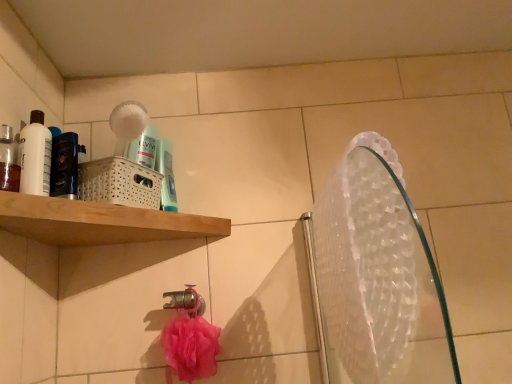
The width and height of the screenshot is (512, 384). What do you see at coordinates (378, 276) in the screenshot? I see `transparent plastic mirror at upper right` at bounding box center [378, 276].

Where is `metallic chrome tap at lower center`? metallic chrome tap at lower center is located at coordinates (186, 301).

I want to click on translucent plastic mouthwash at left, acting as the third mouthwash starting from the right, so tap(9, 160).

This screenshot has width=512, height=384. I want to click on blue glossy mouthwash at upper center, the first mouthwash positioned from the right, so click(166, 176).

You are a GUI agent. You are given a task and a screenshot of the screen. Output one action in this format:
    pyautogui.click(x=<x>, y=<y>)
    Task: Click on the transparent plastic mirror at upper right
    
    Given the screenshot: What is the action you would take?
    pyautogui.click(x=378, y=276)

Can translucent plastic mouthwash at left, which is counted as the 1th mouthwash, starting from the front, be found inside white glossy bottle at left, the second mouthwash positioned from the back?

Actually, translucent plastic mouthwash at left, which is counted as the 1th mouthwash, starting from the front, is outside white glossy bottle at left, the second mouthwash positioned from the back.

Does white glossy bottle at left, the second mouthwash positioned from the back, appear on the left side of translucent plastic mouthwash at left, which appears as the first mouthwash when viewed from the left?

No.

Which point is more distant from viewer, [32,118] or [17,167]?

The point [32,118] is more distant.

Looking at this image, between white glossy bottle at left, the second mouthwash when ordered from front to back, and translucent plastic mouthwash at left, which is counted as the 1th mouthwash, starting from the front, which one has smaller width?

Thinner between the two is white glossy bottle at left, the second mouthwash when ordered from front to back.

In terms of width, does translucent plastic mouthwash at left, acting as the third mouthwash starting from the right, look wider or thinner when compared to metallic chrome tap at lower center?

In the image, translucent plastic mouthwash at left, acting as the third mouthwash starting from the right, appears to be more narrow than metallic chrome tap at lower center.

Is translucent plastic mouthwash at left, which is counted as the 1th mouthwash, starting from the front, facing towards metallic chrome tap at lower center?

No, translucent plastic mouthwash at left, which is counted as the 1th mouthwash, starting from the front, is not oriented towards metallic chrome tap at lower center.

Which is farther from the camera, (18, 178) or (191, 299)?

Positioned behind is point (191, 299).

Is metallic chrome tap at lower center not close to transparent plastic mirror at upper right?

That's not correct — metallic chrome tap at lower center is a little close to transparent plastic mirror at upper right.

In the scene shown: Is the position of metallic chrome tap at lower center less distant than that of transparent plastic mirror at upper right?

No, metallic chrome tap at lower center is further to the viewer.

Can you confirm if metallic chrome tap at lower center is smaller than transparent plastic mirror at upper right?

Yes.

Measure the distance from blue glossy mouthwash at upper center, which is the first mouthwash in back-to-front order, to white glossy bottle at left, the second mouthwash positioned from the back.

A distance of 11.31 inches exists between blue glossy mouthwash at upper center, which is the first mouthwash in back-to-front order, and white glossy bottle at left, the second mouthwash positioned from the back.

Does blue glossy mouthwash at upper center, which is the first mouthwash in back-to-front order, lie in front of white glossy bottle at left, the second mouthwash positioned from the left?

No.

Can you confirm if blue glossy mouthwash at upper center, which is the 3th mouthwash in front-to-back order, is shorter than white glossy bottle at left, the second mouthwash when ordered from front to back?

Yes, blue glossy mouthwash at upper center, which is the 3th mouthwash in front-to-back order, is shorter than white glossy bottle at left, the second mouthwash when ordered from front to back.

Considering the positions of objects blue glossy mouthwash at upper center, which is counted as the third mouthwash, starting from the left, and white glossy bottle at left, the second mouthwash from the right, in the image provided, who is more to the right, blue glossy mouthwash at upper center, which is counted as the third mouthwash, starting from the left, or white glossy bottle at left, the second mouthwash from the right,?

From the viewer's perspective, blue glossy mouthwash at upper center, which is counted as the third mouthwash, starting from the left, appears more on the right side.

Does translucent plastic mouthwash at left, which is counted as the 1th mouthwash, starting from the front, lie in front of white glossy bottle at left, the second mouthwash positioned from the back?

Yes, it is.

How different are the orientations of translucent plastic mouthwash at left, which is counted as the 1th mouthwash, starting from the front, and white glossy bottle at left, the second mouthwash from the right, in degrees?

The angle between the facing direction of translucent plastic mouthwash at left, which is counted as the 1th mouthwash, starting from the front, and the facing direction of white glossy bottle at left, the second mouthwash from the right, is 16.1 degrees.

From a real-world perspective, between translucent plastic mouthwash at left, which is counted as the 1th mouthwash, starting from the front, and white glossy bottle at left, the second mouthwash from the right, who is vertically lower?

translucent plastic mouthwash at left, which is counted as the 1th mouthwash, starting from the front, is physically lower.

Is white glossy bottle at left, the second mouthwash positioned from the left, located within translucent plastic mouthwash at left, the third mouthwash from the back?

No, white glossy bottle at left, the second mouthwash positioned from the left, is not surrounded by translucent plastic mouthwash at left, the third mouthwash from the back.

Is transparent plastic mirror at upper right not inside blue glossy mouthwash at upper center, which is the first mouthwash in back-to-front order?

transparent plastic mirror at upper right lies outside blue glossy mouthwash at upper center, which is the first mouthwash in back-to-front order,'s area.

Considering the positions of point (339, 225) and point (174, 197), is point (339, 225) closer or farther from the camera than point (174, 197)?

Clearly, point (339, 225) is closer to the camera than point (174, 197).

Does transparent plastic mirror at upper right have a lesser width compared to blue glossy mouthwash at upper center, which is the 3th mouthwash in front-to-back order?

No.

Would you say transparent plastic mirror at upper right is outside white glossy bottle at left, the second mouthwash when ordered from front to back?

Yes, transparent plastic mirror at upper right is located beyond the bounds of white glossy bottle at left, the second mouthwash when ordered from front to back.

Which is more to the right, transparent plastic mirror at upper right or white glossy bottle at left, the second mouthwash positioned from the left?

From the viewer's perspective, transparent plastic mirror at upper right appears more on the right side.

Which mouthwash is the 2nd one when counting from the back of the transparent plastic mirror at upper right? Please provide its 2D coordinates.

[(35, 156)]

Is the position of transparent plastic mirror at upper right less distant than that of white glossy bottle at left, the second mouthwash when ordered from front to back?

Yes.

Image resolution: width=512 pixels, height=384 pixels. What are the coordinates of `mouthwash that is on the left side of white glossy bottle at left, the second mouthwash positioned from the back` in the screenshot? It's located at (9, 160).

Where is `the 3rd mouthwash in front of the metallic chrome tap at lower center`? Image resolution: width=512 pixels, height=384 pixels. the 3rd mouthwash in front of the metallic chrome tap at lower center is located at coordinates (9, 160).

Based on their spatial positions, is transparent plastic mirror at upper right or metallic chrome tap at lower center closer to translucent plastic mouthwash at left, which appears as the first mouthwash when viewed from the left?

metallic chrome tap at lower center lies closer to translucent plastic mouthwash at left, which appears as the first mouthwash when viewed from the left, than the other object.

Which object lies further to the anchor point blue glossy mouthwash at upper center, which is the first mouthwash in back-to-front order, translucent plastic mouthwash at left, which appears as the first mouthwash when viewed from the left, or transparent plastic mirror at upper right?

transparent plastic mirror at upper right.

When comparing their distances from metallic chrome tap at lower center, does transparent plastic mirror at upper right or white glossy bottle at left, the second mouthwash from the right, seem closer?

Based on the image, white glossy bottle at left, the second mouthwash from the right, appears to be nearer to metallic chrome tap at lower center.

Looking at the image, which one is located closer to translucent plastic mouthwash at left, which is counted as the 1th mouthwash, starting from the front, transparent plastic mirror at upper right or white glossy bottle at left, the second mouthwash when ordered from front to back?

white glossy bottle at left, the second mouthwash when ordered from front to back, is closer to translucent plastic mouthwash at left, which is counted as the 1th mouthwash, starting from the front.

Estimate the real-world distances between objects in this image. Which object is closer to transparent plastic mirror at upper right, metallic chrome tap at lower center or white glossy bottle at left, the second mouthwash positioned from the back?

Among the two, metallic chrome tap at lower center is located nearer to transparent plastic mirror at upper right.

Which object lies nearer to the anchor point white glossy bottle at left, the second mouthwash when ordered from front to back, metallic chrome tap at lower center or translucent plastic mouthwash at left, acting as the third mouthwash starting from the right?

The object closer to white glossy bottle at left, the second mouthwash when ordered from front to back, is translucent plastic mouthwash at left, acting as the third mouthwash starting from the right.

Consider the image. Which object lies further to the anchor point translucent plastic mouthwash at left, which is counted as the 1th mouthwash, starting from the front, white glossy bottle at left, the second mouthwash from the right, or metallic chrome tap at lower center?

Based on the image, metallic chrome tap at lower center appears to be further to translucent plastic mouthwash at left, which is counted as the 1th mouthwash, starting from the front.

Looking at this image, when comparing their distances from translucent plastic mouthwash at left, acting as the third mouthwash starting from the right, does blue glossy mouthwash at upper center, which is the 3th mouthwash in front-to-back order, or white glossy bottle at left, the second mouthwash positioned from the left, seem further?

blue glossy mouthwash at upper center, which is the 3th mouthwash in front-to-back order, is positioned further to the anchor translucent plastic mouthwash at left, acting as the third mouthwash starting from the right.

I want to click on tap between white glossy bottle at left, the second mouthwash from the right, and transparent plastic mirror at upper right, in the horizontal direction, so click(186, 301).

At what (x,y) coordinates should I click in order to perform the action: click on tap between translucent plastic mouthwash at left, which appears as the first mouthwash when viewed from the left, and transparent plastic mirror at upper right. Please return your answer as a coordinate pair (x, y). Image resolution: width=512 pixels, height=384 pixels. Looking at the image, I should click on (186, 301).

You are a GUI agent. You are given a task and a screenshot of the screen. Output one action in this format:
    pyautogui.click(x=<x>, y=<y>)
    Task: Click on the mouthwash between translucent plastic mouthwash at left, the third mouthwash from the back, and blue glossy mouthwash at upper center, which is the 3th mouthwash in front-to-back order, in the horizontal direction
    
    Given the screenshot: What is the action you would take?
    pyautogui.click(x=35, y=156)

Identify the location of mouthwash between translucent plastic mouthwash at left, the third mouthwash from the back, and metallic chrome tap at lower center in the up-down direction. (166, 176).